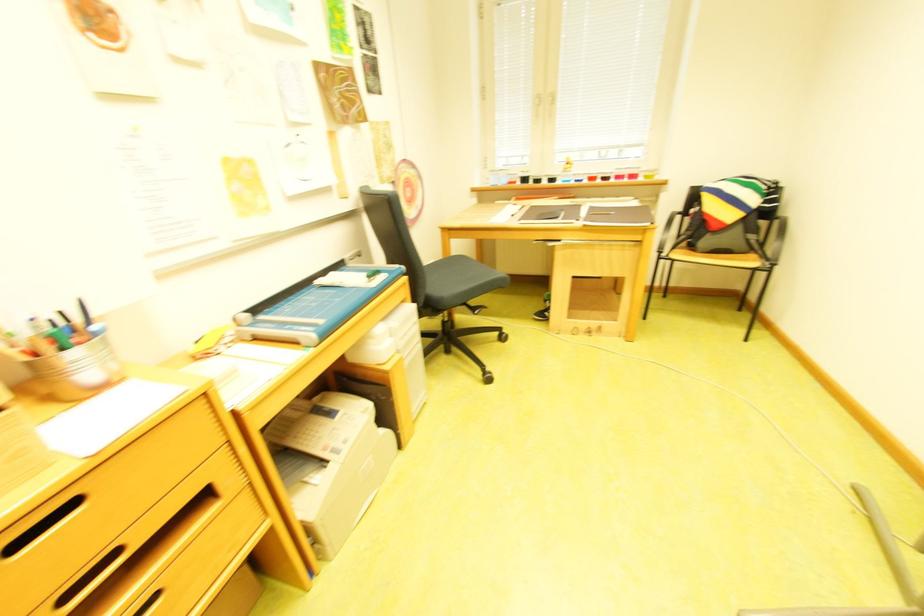
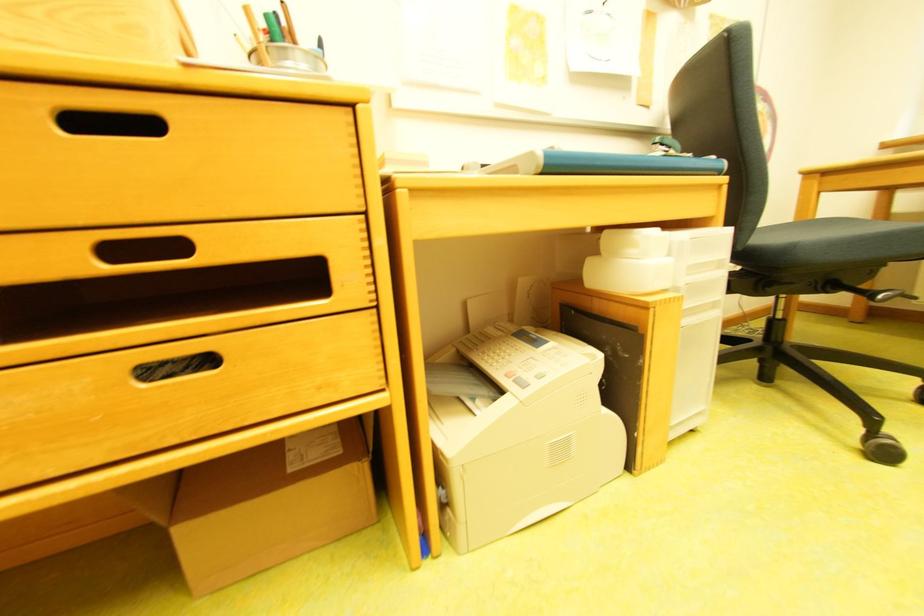
Question: The images are taken continuously from a first-person perspective. In which direction is your viewpoint rotating?

Choices:
 (A) Left
 (B) Right
 (C) Up
 (D) Down

Answer: (A)